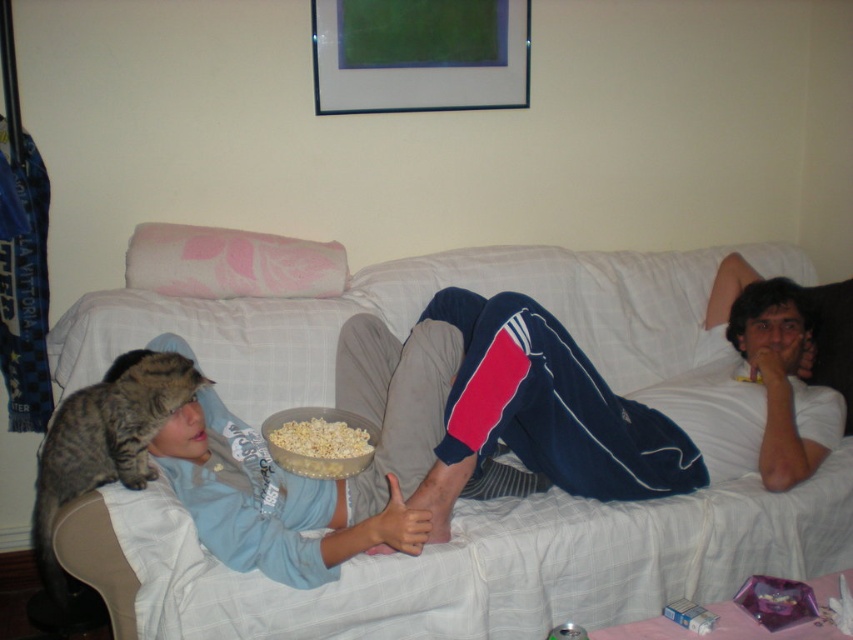
Between point (540, 268) and point (332, 417), which one is positioned behind?

The point (540, 268) is more distant.

What are the coordinates of `white fabric couch at center` in the screenshot? It's located at 489,564.

Does point (157, 552) lie behind point (71, 397)?

No, (157, 552) is in front of (71, 397).

Is white fabric couch at center wider than tabby fur cat at left?

Yes.

What are the coordinates of `white fabric couch at center` in the screenshot? It's located at (489, 564).

Which is more to the left, blue track pants at center or tabby fur cat at left?

tabby fur cat at left is more to the left.

Find the location of a particular element. Image resolution: width=853 pixels, height=640 pixels. blue track pants at center is located at coordinates (581, 401).

The height and width of the screenshot is (640, 853). In order to click on blue track pants at center in this screenshot , I will do [581, 401].